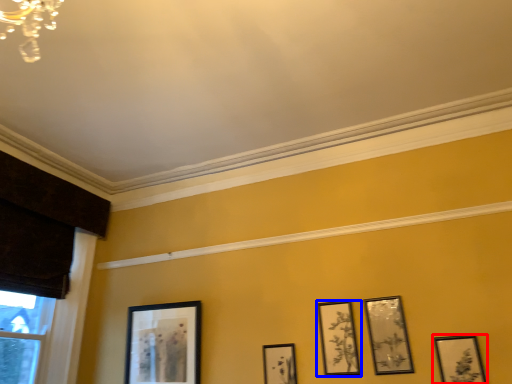
Question: Which object is further to the camera taking this photo, picture frame (highlighted by a red box) or picture frame (highlighted by a blue box)?

Choices:
 (A) picture frame
 (B) picture frame

Answer: (B)